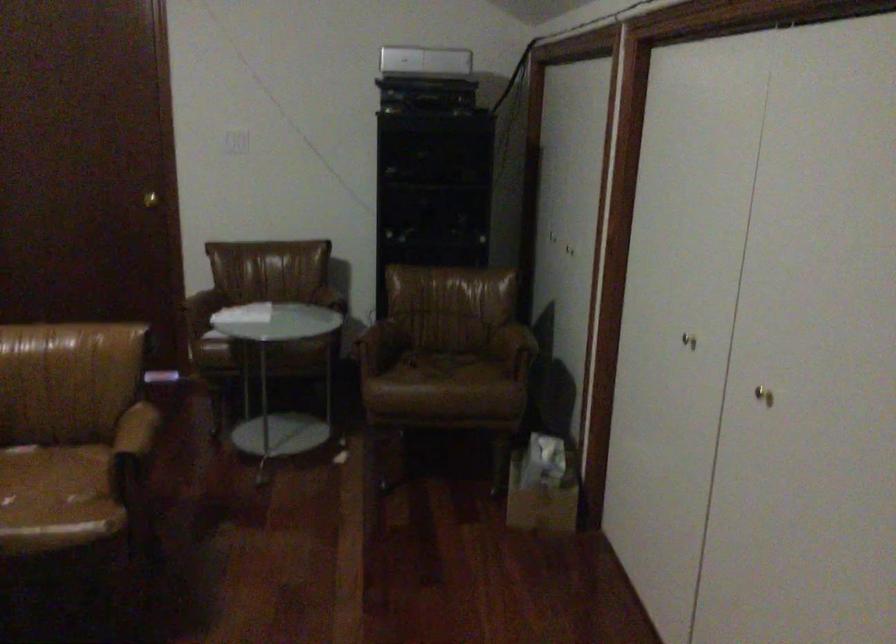
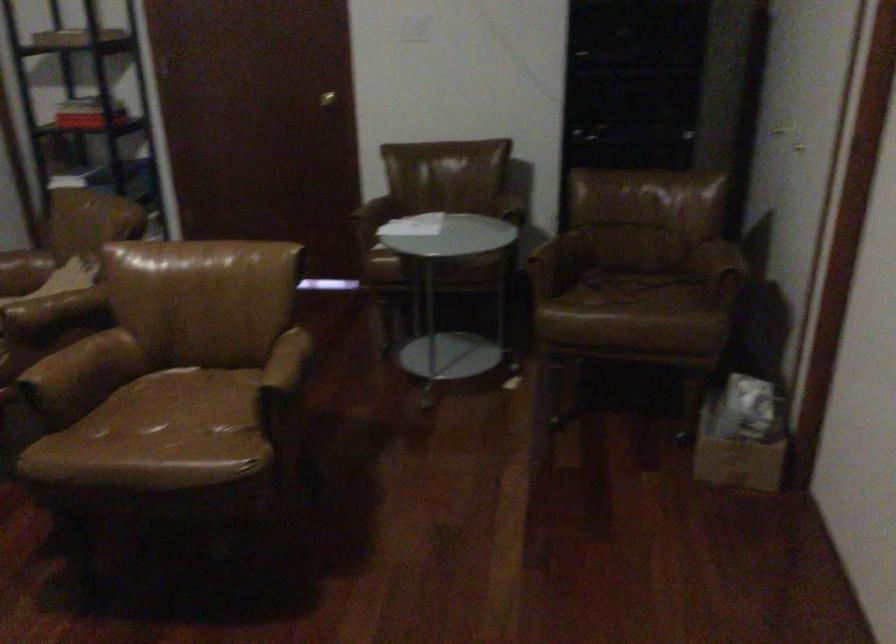
Where in the second image is the point corresponding to pixel 149 196 from the first image?

(326, 99)